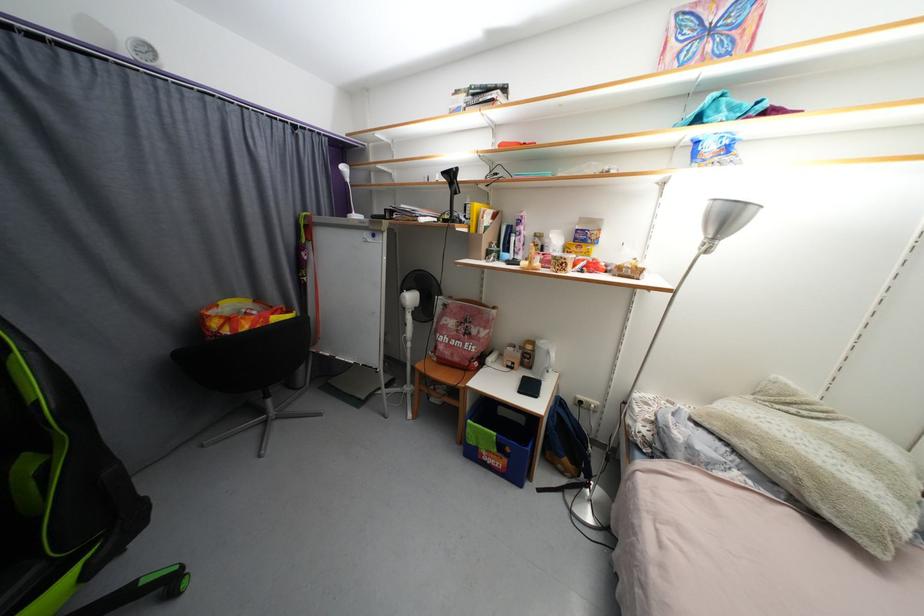
Identify the location of white desk lamp. (348, 191).